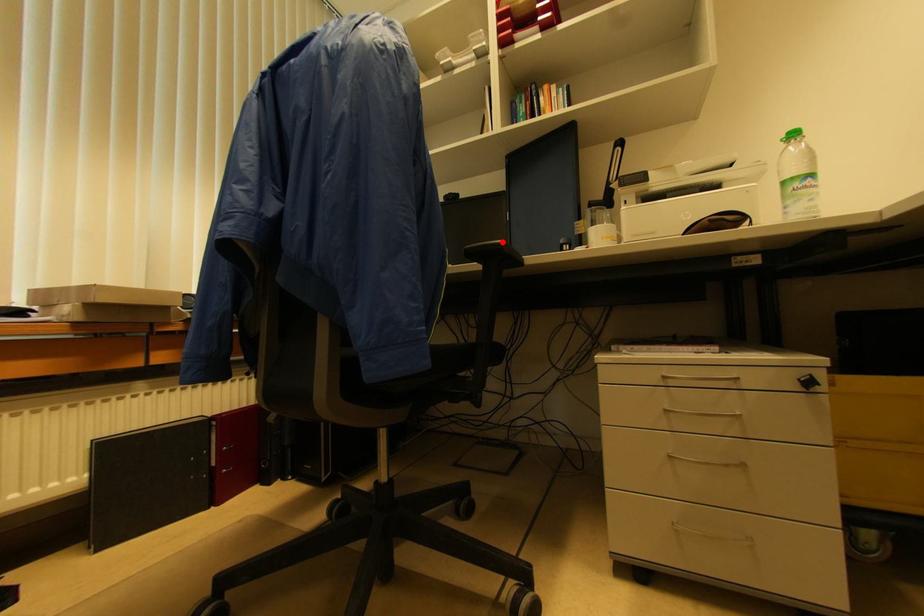
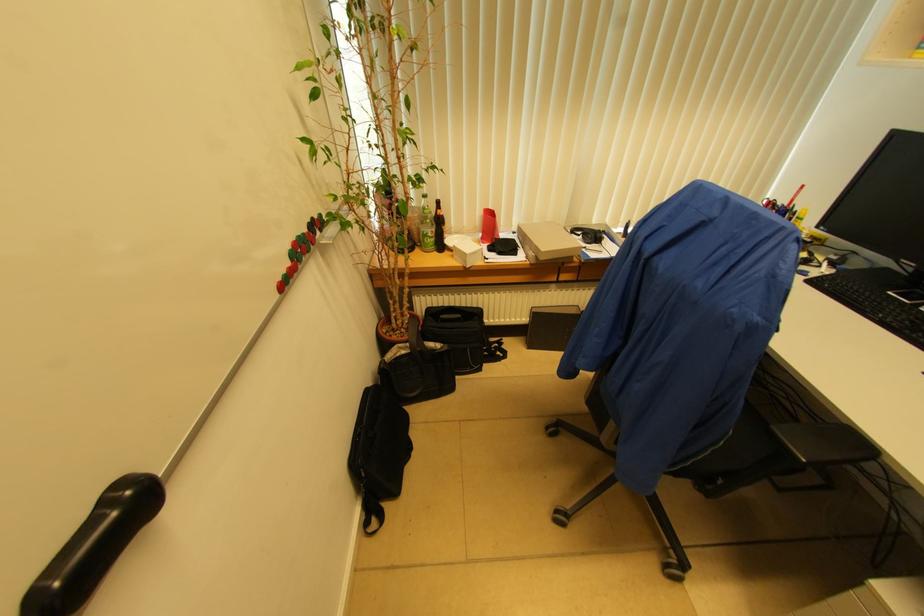
Find the pixel in the second image that matches the highlighted location in the first image.

(807, 461)